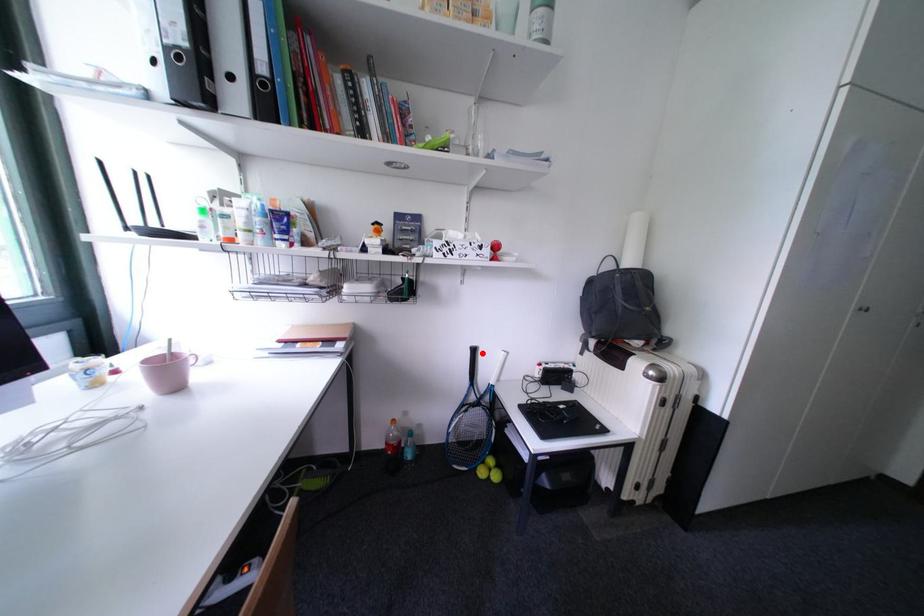
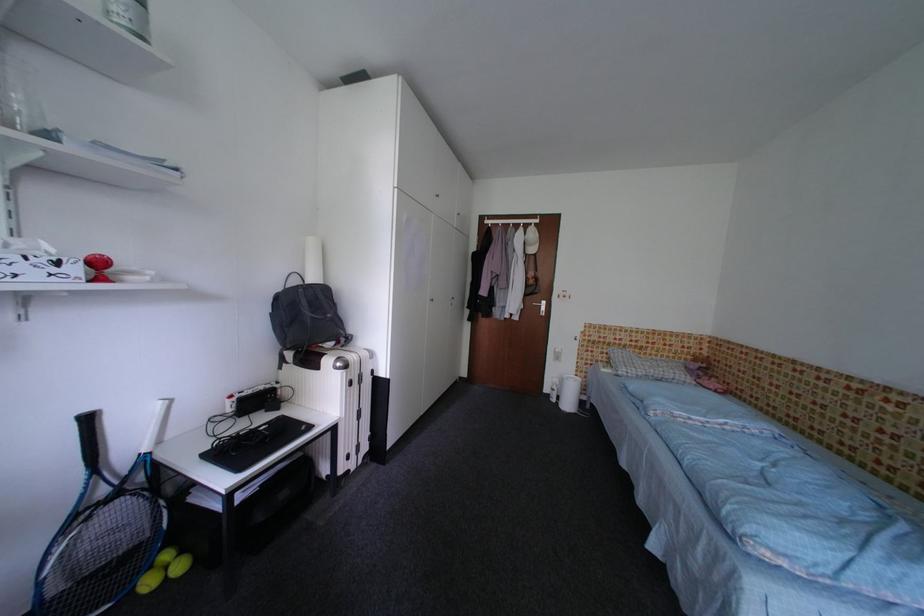
In the second image, find the point that corresponds to the highlighted location in the first image.

(98, 422)